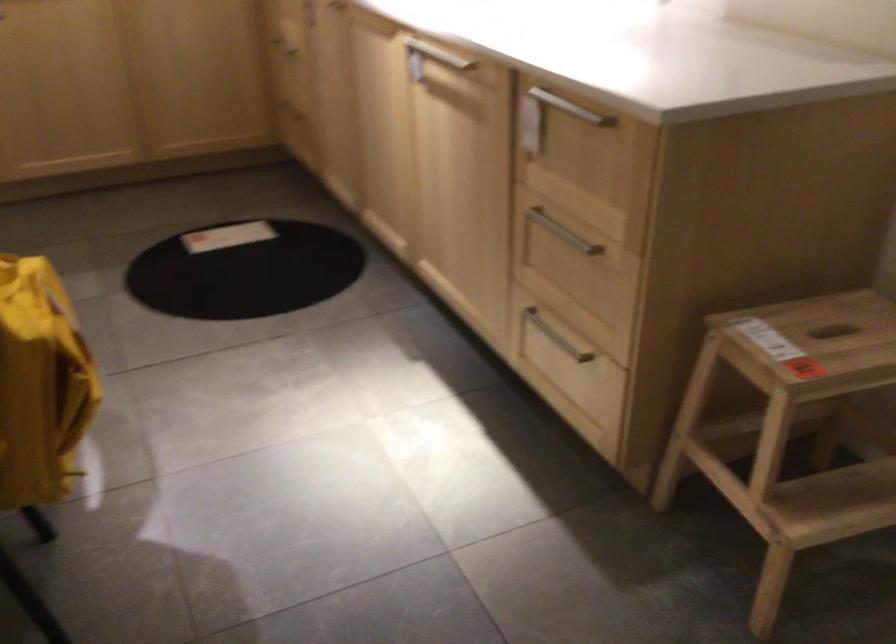
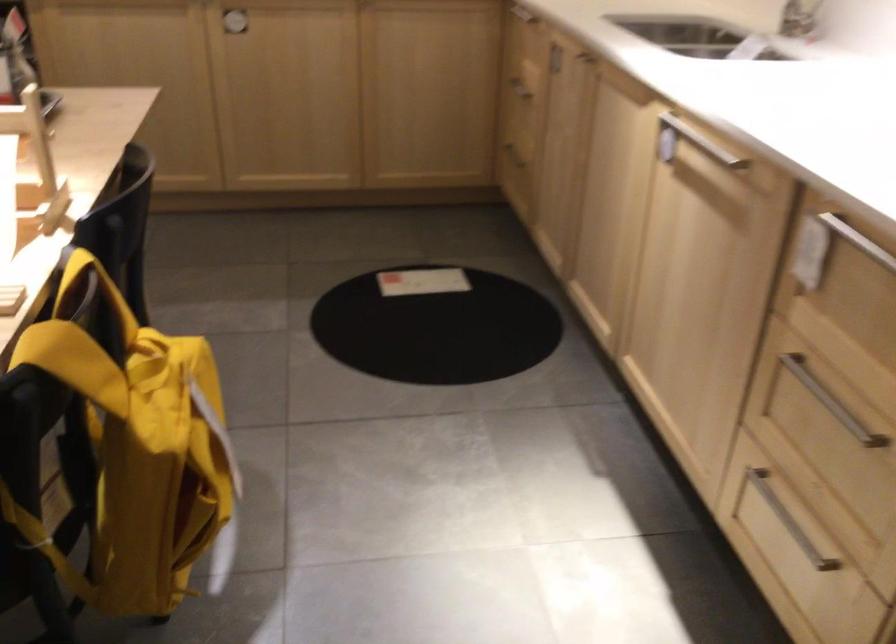
Question: How did the camera likely rotate?

Choices:
 (A) Left
 (B) Right
 (C) Up
 (D) Down

Answer: (A)